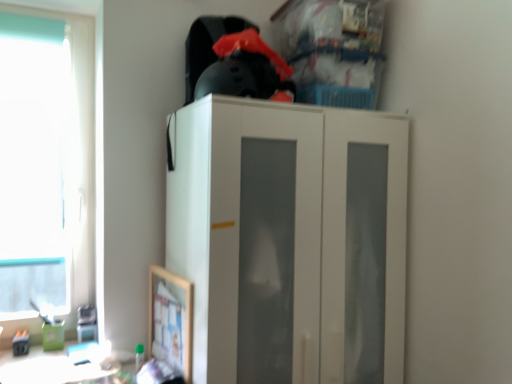
Question: Does white matte cabinet at center have a larger size compared to transparent glass window at left?

Choices:
 (A) no
 (B) yes

Answer: (B)

Question: Is transparent glass window at left a part of white matte cabinet at center?

Choices:
 (A) no
 (B) yes

Answer: (A)

Question: Is white matte cabinet at center at the left side of transparent glass window at left?

Choices:
 (A) yes
 (B) no

Answer: (B)

Question: Could you tell me if white matte cabinet at center is turned towards transparent glass window at left?

Choices:
 (A) yes
 (B) no

Answer: (B)

Question: Can you confirm if white matte cabinet at center is thinner than transparent glass window at left?

Choices:
 (A) no
 (B) yes

Answer: (A)

Question: Is white matte cabinet at center at the right side of transparent glass window at left?

Choices:
 (A) yes
 (B) no

Answer: (A)

Question: Is transparent glass window at left thinner than white matte cabinet at center?

Choices:
 (A) yes
 (B) no

Answer: (A)

Question: From a real-world perspective, is transparent glass window at left positioned over white matte cabinet at center based on gravity?

Choices:
 (A) no
 (B) yes

Answer: (B)

Question: Does transparent glass window at left have a greater height compared to white matte cabinet at center?

Choices:
 (A) yes
 (B) no

Answer: (A)

Question: Is transparent glass window at left closer to the viewer compared to white matte cabinet at center?

Choices:
 (A) yes
 (B) no

Answer: (B)

Question: From a real-world perspective, is transparent glass window at left physically below white matte cabinet at center?

Choices:
 (A) no
 (B) yes

Answer: (A)

Question: From the image's perspective, is transparent glass window at left over white matte cabinet at center?

Choices:
 (A) yes
 (B) no

Answer: (A)

Question: Considering the relative positions of white matte cabinet at center and transparent glass window at left in the image provided, is white matte cabinet at center to the left or to the right of transparent glass window at left?

Choices:
 (A) left
 (B) right

Answer: (B)